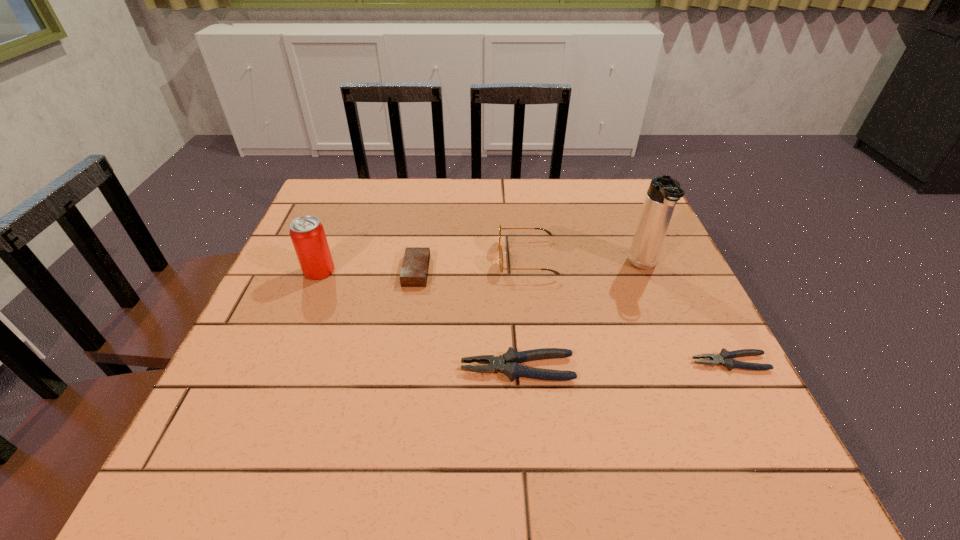
Find the location of a particular element. blank area at the near right corner is located at coordinates (727, 397).

At what (x,y) coordinates should I click in order to perform the action: click on vacant area that lies between the third tallest object and the thermos bottle. Please return your answer as a coordinate pair (x, y). This screenshot has height=540, width=960. Looking at the image, I should click on (585, 262).

Find the location of a particular element. free space between the tallest object and the taller pliers is located at coordinates (581, 317).

Find the location of a particular element. unoccupied area between the can and the thermos bottle is located at coordinates (481, 268).

Identify the location of vacant space that is in between the alarm clock and the leftmost object. (368, 271).

Where is `vacant space that is in between the shorter pliers and the taller pliers`? vacant space that is in between the shorter pliers and the taller pliers is located at coordinates (624, 366).

The height and width of the screenshot is (540, 960). Identify the location of empty space between the sunglasses and the right pliers. (628, 310).

At what (x,y) coordinates should I click in order to perform the action: click on empty space that is in between the thermos bottle and the leftmost object. Please return your answer as a coordinate pair (x, y). The height and width of the screenshot is (540, 960). Looking at the image, I should click on (481, 268).

Find the location of a particular element. The width and height of the screenshot is (960, 540). empty location between the thermos bottle and the alarm clock is located at coordinates (530, 268).

The height and width of the screenshot is (540, 960). I want to click on vacant region between the left pliers and the thermos bottle, so click(x=581, y=317).